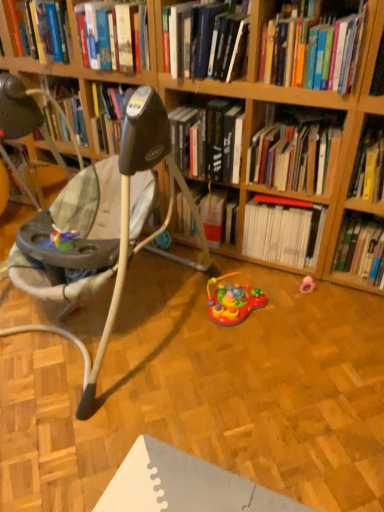
You are a GUI agent. You are given a task and a screenshot of the screen. Output one action in this format:
    pyautogui.click(x=<x>, y=<y>)
    Task: Click on the vacant space in front of beige fabric baby swing at left
    
    Given the screenshot: What is the action you would take?
    pyautogui.click(x=142, y=436)